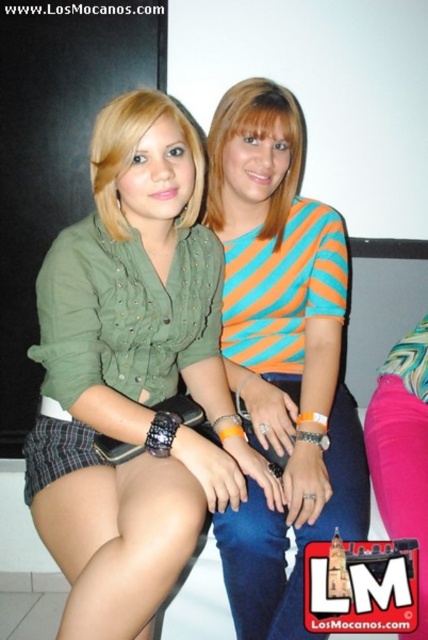
Question: Where is green fabric shirt at center located in relation to orange striped shirt at center in the image?

Choices:
 (A) left
 (B) right

Answer: (A)

Question: Is green fabric shirt at center to the right of orange striped shirt at center from the viewer's perspective?

Choices:
 (A) no
 (B) yes

Answer: (A)

Question: Can you confirm if green fabric shirt at center is positioned to the left of orange striped shirt at center?

Choices:
 (A) no
 (B) yes

Answer: (B)

Question: Among these objects, which one is nearest to the camera?

Choices:
 (A) orange striped shirt at center
 (B) green fabric shirt at center

Answer: (B)